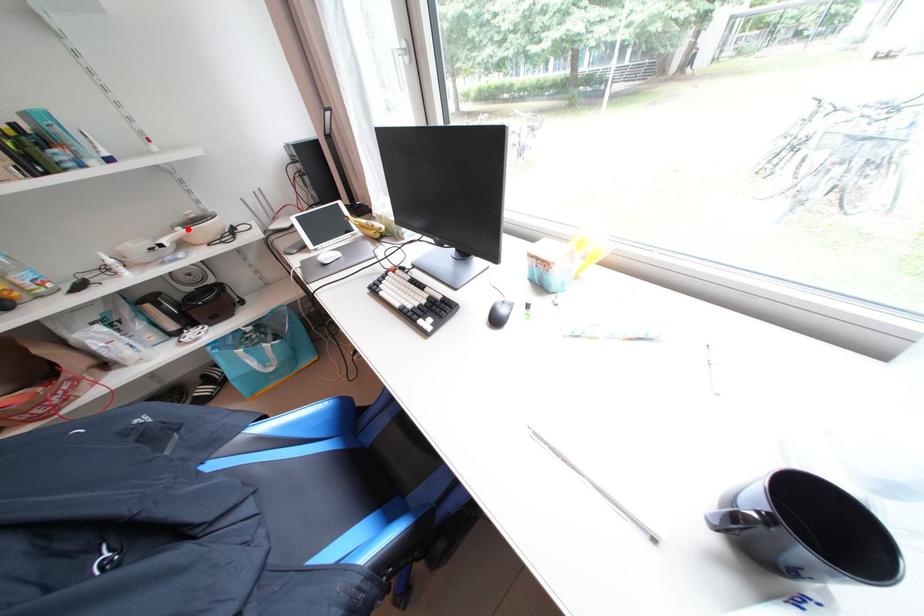
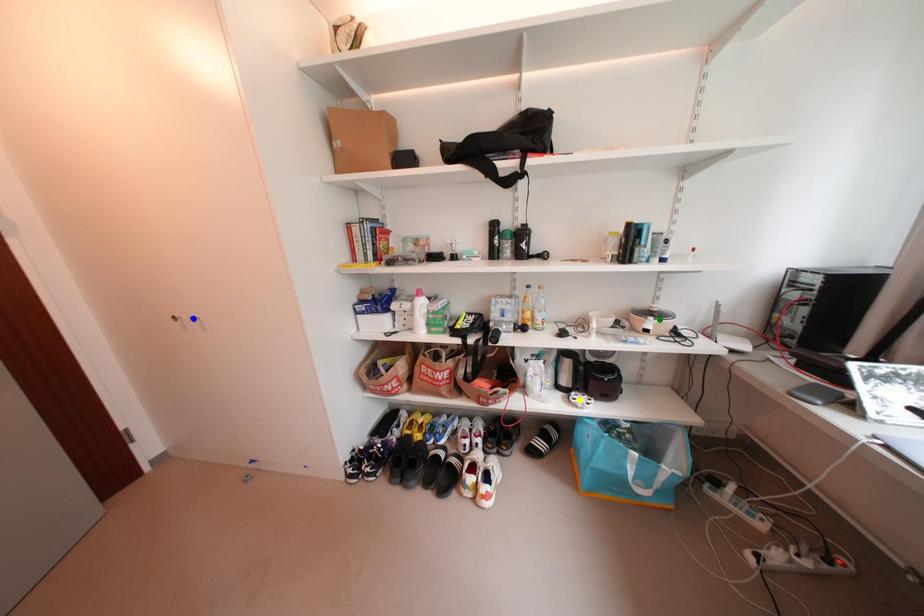
Question: I am providing you with two images of the same scene from different viewpoints. A red point is marked on the first image. You are given multiple points on the second image. Which mark in image 2 goes with the point in image 1?

Choices:
 (A) green point
 (B) yellow point
 (C) blue point

Answer: (A)